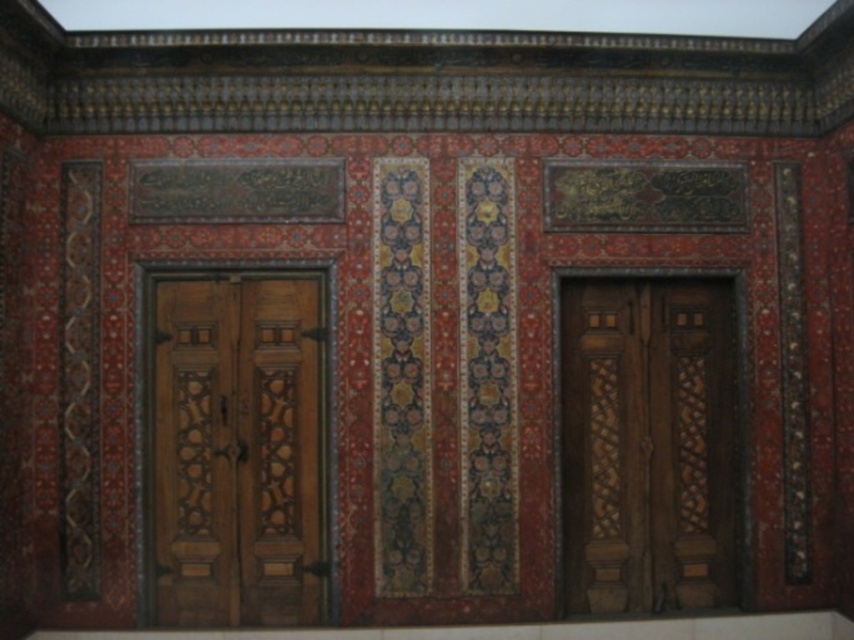
You are an interior designer planning to hang a large painting between the polished wood door at left and the wooden carved door at center. Based on their positions, can you determine which door is closer to the painting? Please explain your reasoning.

The polished wood door at left is positioned over the wooden carved door at center, meaning it is closer to the observer. Therefore, the polished wood door at left is closer to the painting than the wooden carved door at center.

You are an interior designer planning to install a decorative shelf between the polished wood door at left and the wooden carved door at center. The shelf you have in mind is 10 feet long. Based on the space between the doors, will the shelf fit without overlapping either door?

The distance between the polished wood door at left and the wooden carved door at center is 9.69 feet. Since the shelf is 10 feet long, it will not fit as it is slightly longer than the available space between the doors.

You are an interior designer planning to place a large vase between the polished wood door at left and the wooden carved door at center. Based on their positions, where should you place the vase to ensure it is centered between them?

The polished wood door at left is positioned on the left side of wooden carved door at center, so placing the vase directly between them would require positioning it to the right of the polished wood door at left and to the left of the wooden carved door at center, ensuring it is centered between both doors.